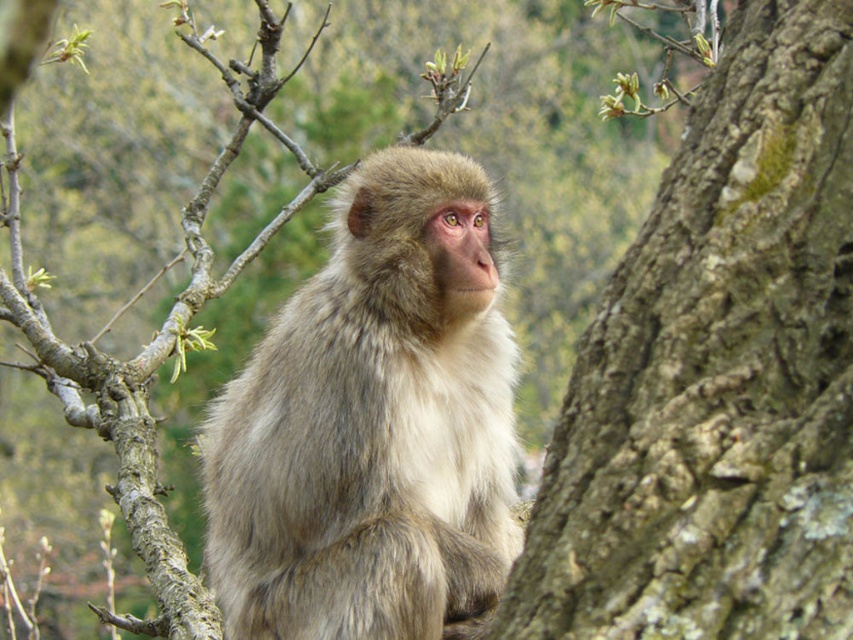
Question: Which object is farther from the camera taking this photo?

Choices:
 (A) brown rough bark at right
 (B) fuzzy fur monkey at center

Answer: (B)

Question: Is brown rough bark at right behind fuzzy fur monkey at center?

Choices:
 (A) no
 (B) yes

Answer: (A)

Question: Which point is farther to the camera?

Choices:
 (A) (848, 208)
 (B) (350, 429)

Answer: (B)

Question: Can you confirm if brown rough bark at right is positioned below fuzzy fur monkey at center?

Choices:
 (A) no
 (B) yes

Answer: (A)

Question: Does brown rough bark at right appear over fuzzy fur monkey at center?

Choices:
 (A) no
 (B) yes

Answer: (B)